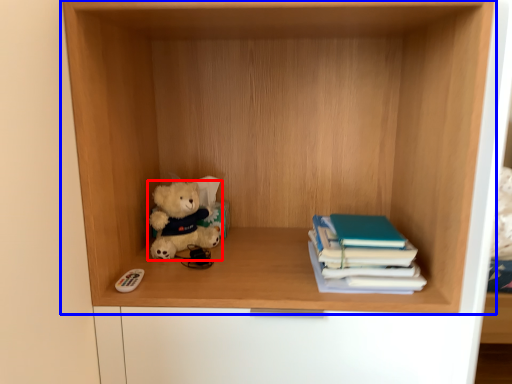
Question: Which point is closer to the camera, teddy bear (highlighted by a red box) or shelf (highlighted by a blue box)?

Choices:
 (A) teddy bear
 (B) shelf

Answer: (B)